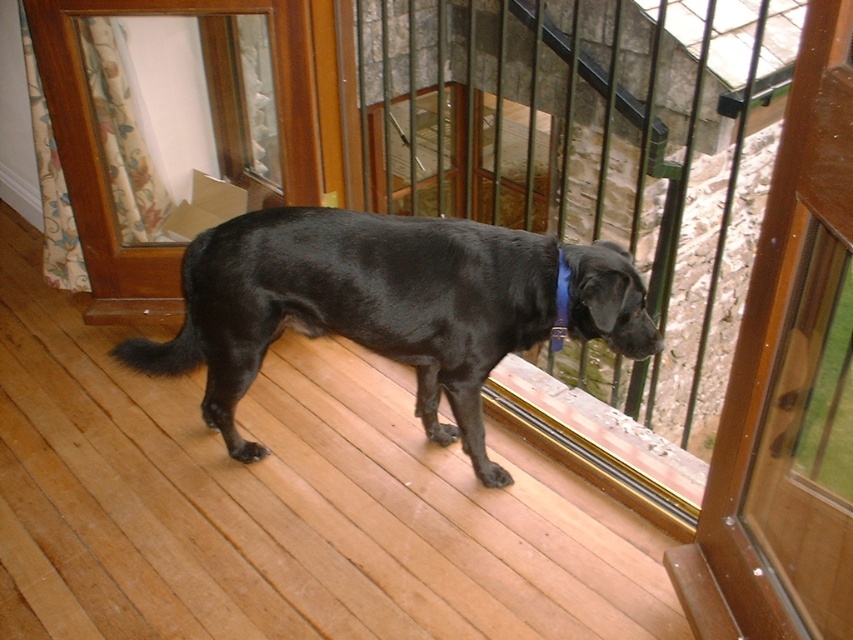
Does shiny black dog at center have a smaller size compared to transparent glass screen door at lower left?

Incorrect, shiny black dog at center is not smaller in size than transparent glass screen door at lower left.

Can you confirm if shiny black dog at center is positioned to the right of transparent glass screen door at lower left?

Yes, shiny black dog at center is to the right of transparent glass screen door at lower left.

Which is in front, point (431, 353) or point (94, 132)?

Point (431, 353)

You are a GUI agent. You are given a task and a screenshot of the screen. Output one action in this format:
    pyautogui.click(x=<x>, y=<y>)
    Task: Click on the shiny black dog at center
    The image size is (853, 640).
    Given the screenshot: What is the action you would take?
    pyautogui.click(x=387, y=307)

Which is more to the right, shiny black dog at center or blue fabric neckband at center?

From the viewer's perspective, blue fabric neckband at center appears more on the right side.

Is shiny black dog at center wider than blue fabric neckband at center?

Yes, shiny black dog at center is wider than blue fabric neckband at center.

Who is more distant from viewer, (601,326) or (564,291)?

Positioned behind is point (564,291).

This screenshot has width=853, height=640. In order to click on shiny black dog at center in this screenshot , I will do `click(387, 307)`.

Can you confirm if transparent glass screen door at lower left is smaller than blue fabric neckband at center?

Actually, transparent glass screen door at lower left might be larger than blue fabric neckband at center.

Can you confirm if transparent glass screen door at lower left is positioned to the left of blue fabric neckband at center?

Yes, transparent glass screen door at lower left is to the left of blue fabric neckband at center.

Does point (308, 17) lie in front of point (560, 314)?

No, (308, 17) is further to viewer.

The image size is (853, 640). I want to click on transparent glass screen door at lower left, so click(102, 163).